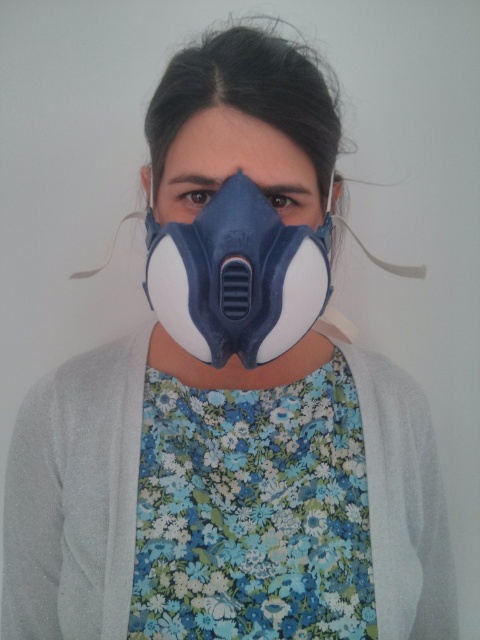
Question: Among these points, which one is nearest to the camera?

Choices:
 (A) (239, 141)
 (B) (155, 310)

Answer: (A)

Question: Which of the following is the closest to the observer?

Choices:
 (A) matte blue respirator at center
 (B) matte blue/white mask at center

Answer: (B)

Question: Is matte blue/white mask at center behind matte blue respirator at center?

Choices:
 (A) no
 (B) yes

Answer: (A)

Question: Where is matte blue/white mask at center located in relation to matte blue respirator at center in the image?

Choices:
 (A) below
 (B) above

Answer: (A)

Question: Does matte blue/white mask at center appear over matte blue respirator at center?

Choices:
 (A) no
 (B) yes

Answer: (A)

Question: Which point is farther to the camera?

Choices:
 (A) (229, 284)
 (B) (336, 186)

Answer: (B)